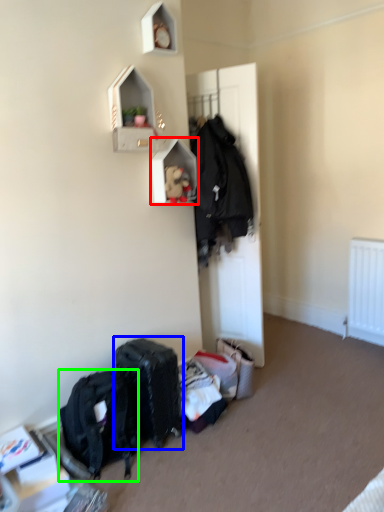
Question: Considering the real-world distances, which object is closest to shelf (highlighted by a red box)? luggage and bags (highlighted by a blue box) or backpack (highlighted by a green box).

Choices:
 (A) luggage and bags
 (B) backpack

Answer: (A)